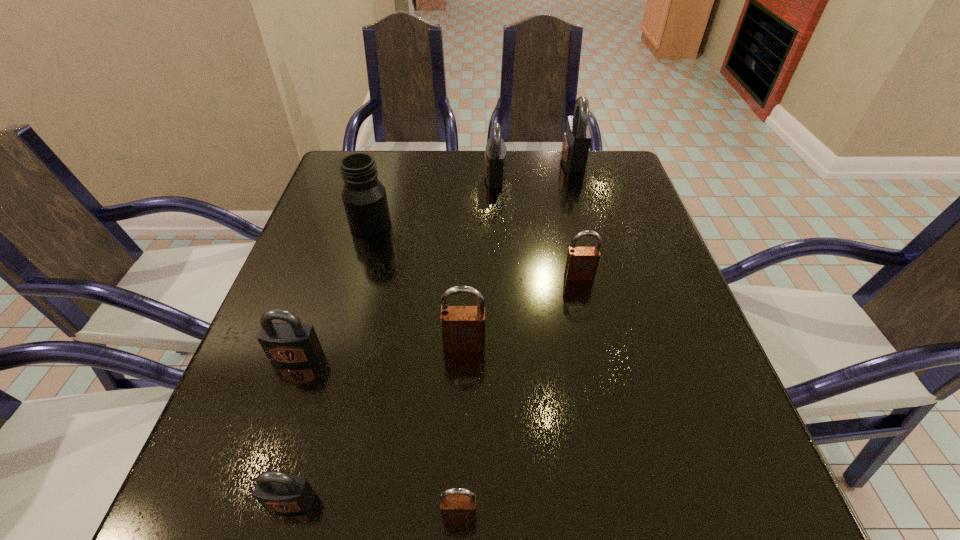
In the image, there is a desktop. Where is `free space at the far right corner`? free space at the far right corner is located at coordinates (570, 173).

The width and height of the screenshot is (960, 540). I want to click on vacant space at the near right corner of the desktop, so click(x=733, y=480).

This screenshot has width=960, height=540. I want to click on free space between the second biggest gray padlock and the nearest gray padlock, so click(x=393, y=339).

Where is `free space that is in between the farthest brown padlock and the biggest brown padlock`? Image resolution: width=960 pixels, height=540 pixels. free space that is in between the farthest brown padlock and the biggest brown padlock is located at coordinates click(521, 310).

What are the coordinates of `free point between the biggest brown padlock and the rightmost gray padlock` in the screenshot? It's located at tap(518, 252).

Identify the location of vacant area between the fifth nearest padlock and the third farthest gray padlock. The width and height of the screenshot is (960, 540). (438, 316).

You are a GUI agent. You are given a task and a screenshot of the screen. Output one action in this format:
    pyautogui.click(x=<x>, y=<y>)
    Task: Click on the free space between the second smallest brown padlock and the sixth object from left to right
    This screenshot has width=960, height=540.
    Given the screenshot: What is the action you would take?
    pyautogui.click(x=537, y=226)

At what (x,y) coordinates should I click in order to perform the action: click on free space between the third farthest gray padlock and the third padlock from right to left. Please return your answer as a coordinate pair (x, y). The width and height of the screenshot is (960, 540). Looking at the image, I should click on (396, 266).

Locate an element on the screen. This screenshot has height=540, width=960. vacant space that's between the second smallest gray padlock and the fourth farthest object is located at coordinates (438, 316).

Identify the location of empty space between the third farthest gray padlock and the biggest brown padlock. The width and height of the screenshot is (960, 540). (380, 350).